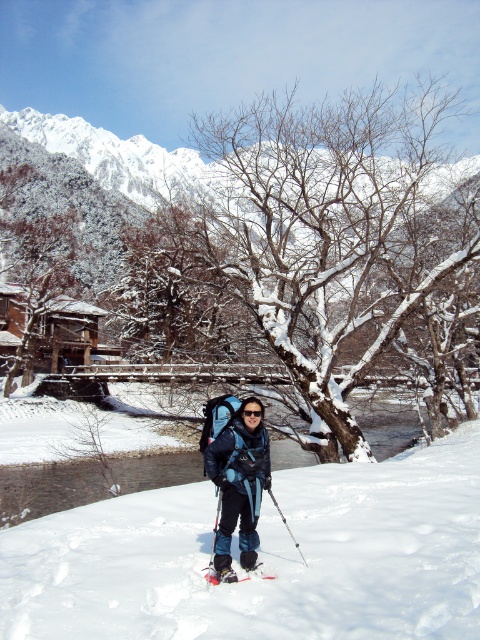
Is white fluffy snow at center thinner than blue fabric backpack at center?

No, white fluffy snow at center is not thinner than blue fabric backpack at center.

Does white fluffy snow at center have a lesser height compared to blue fabric backpack at center?

Correct, white fluffy snow at center is not as tall as blue fabric backpack at center.

Describe the element at coordinates (263, 557) in the screenshot. I see `white fluffy snow at center` at that location.

This screenshot has height=640, width=480. Identify the location of white fluffy snow at center. (263, 557).

Can you confirm if blue fabric backpack at center is bigger than shiny metallic ski at center?

Indeed, blue fabric backpack at center has a larger size compared to shiny metallic ski at center.

Does blue fabric backpack at center appear over shiny metallic ski at center?

Yes.

Is point (228, 506) behind point (227, 580)?

Yes, it is behind point (227, 580).

Where is `blue fabric backpack at center`? The height and width of the screenshot is (640, 480). blue fabric backpack at center is located at coordinates (239, 484).

Does snowy bark tree at center come in front of shiny metallic ski at center?

No, it is not.

Which is in front, point (422, 264) or point (223, 579)?

Point (223, 579)

Image resolution: width=480 pixels, height=640 pixels. Identify the location of snowy bark tree at center. (325, 236).